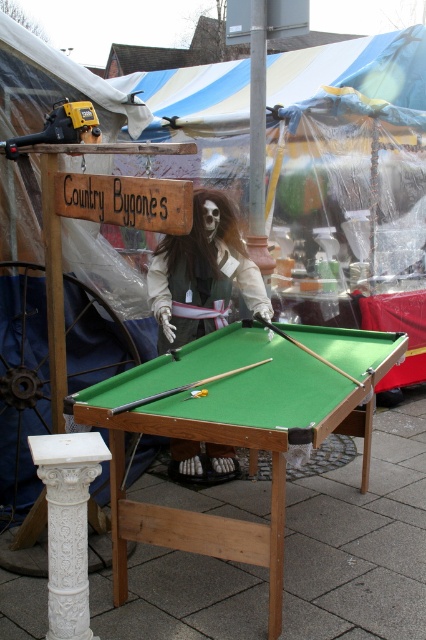
You are a customer at the fair who wants to play pool. You see the green felt pool table at center and the white fabric skeleton at center. Which object is higher?

The green felt pool table at center is much taller than the white fabric skeleton at center, so the green felt pool table at center is higher.

You are at a fair and see the green felt pool table at center and the smooth wood cue at center. Which object is positioned to the left?

The green felt pool table at center is to the left of the smooth wood cue at center.

You are standing in front of the pool table and want to place an object at point (181, 289) and another at point (285, 333). Which point is closer to you?

Point (181, 289) is further to the camera than point (285, 333). Therefore, point (285, 333) is closer to you.